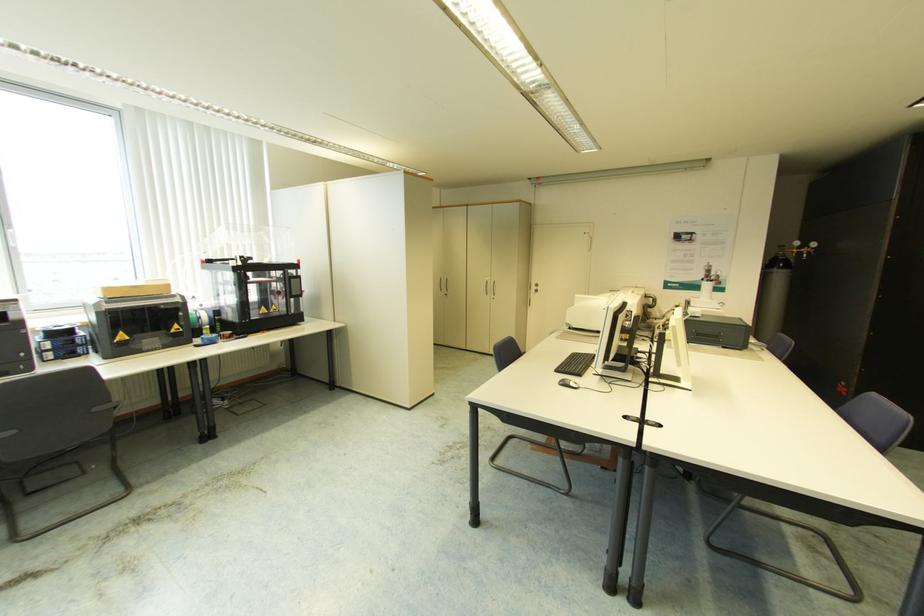
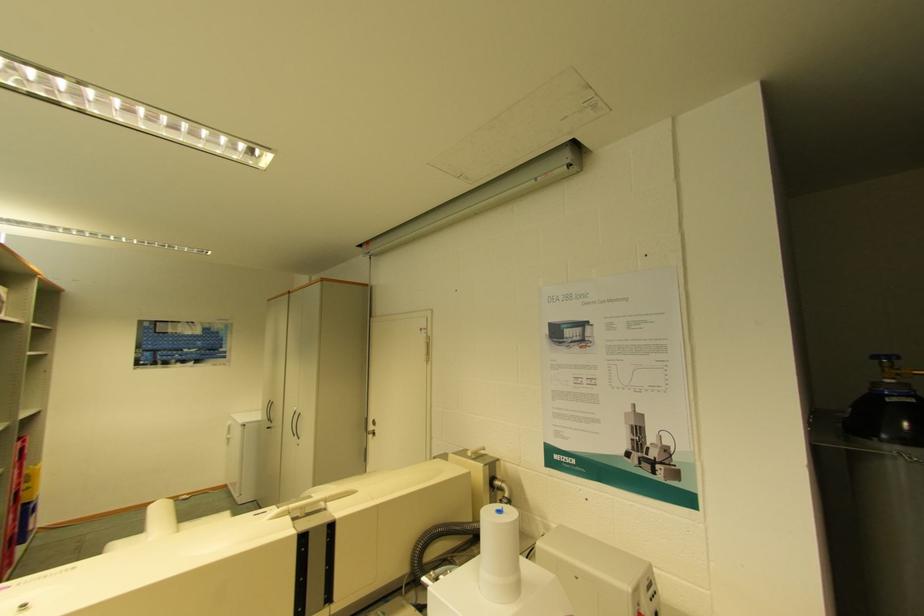
Which direction would the cameraman need to move to produce the second image?

The cameraman moved toward right, forward.